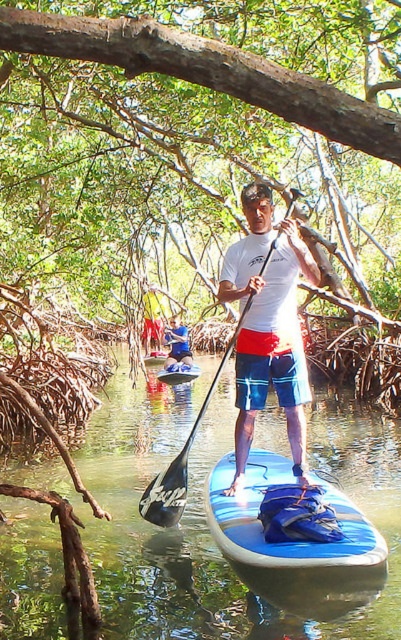
Is white matte shirt at center thinner than blue glossy canoe at center?

Yes, white matte shirt at center is thinner than blue glossy canoe at center.

Between white matte shirt at center and blue glossy canoe at center, which one appears on the right side from the viewer's perspective?

white matte shirt at center is more to the right.

Measure the distance between white matte shirt at center and camera.

white matte shirt at center is 4.46 meters away from camera.

Where is `white matte shirt at center`? white matte shirt at center is located at coordinates (267, 324).

Which is in front, point (151, 632) or point (188, 380)?

Positioned in front is point (151, 632).

Does blue rubber paddleboard at center appear over blue glossy canoe at center?

No, blue rubber paddleboard at center is not above blue glossy canoe at center.

The height and width of the screenshot is (640, 401). Describe the element at coordinates (204, 515) in the screenshot. I see `blue rubber paddleboard at center` at that location.

In order to click on blue rubber paddleboard at center in this screenshot , I will do `click(204, 515)`.

Is point (241, 266) farther from viewer compared to point (166, 368)?

No, it is in front of (166, 368).

Is white matte shirt at center shorter than blue fabric shorts at center?

No.

Locate an element on the screen. The image size is (401, 640). white matte shirt at center is located at coordinates (267, 324).